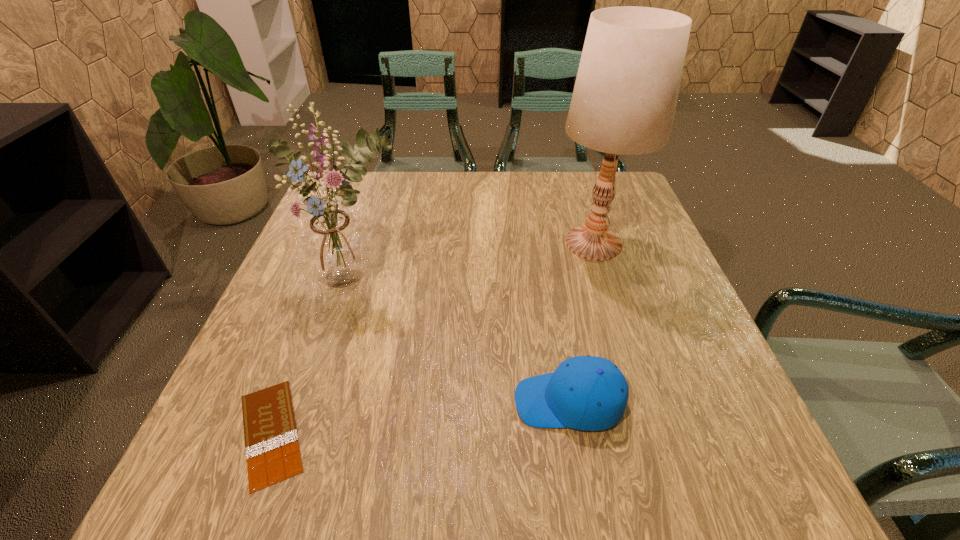
The width and height of the screenshot is (960, 540). I want to click on object at the near edge, so click(x=272, y=449).

Find the location of a particular element. This screenshot has width=960, height=540. bouquet that is at the left edge is located at coordinates (335, 247).

Locate an element on the screen. The image size is (960, 540). chocolate bar located at the left edge is located at coordinates (x=272, y=449).

At what (x,y) coordinates should I click in order to perform the action: click on object that is positioned at the right edge. Please return your answer as a coordinate pair (x, y). Looking at the image, I should click on tap(624, 100).

Find the location of a particular element. The height and width of the screenshot is (540, 960). object that is at the near left corner is located at coordinates [x=272, y=449].

Image resolution: width=960 pixels, height=540 pixels. In the image, there is a desktop. Find the location of `blank space at the far edge`. blank space at the far edge is located at coordinates (379, 215).

Identify the location of vacant space at the far left corner. (354, 186).

Identify the location of free space between the second tallest object and the chocolate bar. The image size is (960, 540). (313, 357).

You are a GUI agent. You are given a task and a screenshot of the screen. Output one action in this format:
    pyautogui.click(x=<x>, y=<y>)
    Task: Click on the vacant area between the cap and the tallest object
    The width and height of the screenshot is (960, 540).
    Given the screenshot: What is the action you would take?
    pyautogui.click(x=581, y=322)

This screenshot has width=960, height=540. What are the coordinates of `blank region between the second shortest object and the third shortest object` in the screenshot? It's located at (463, 342).